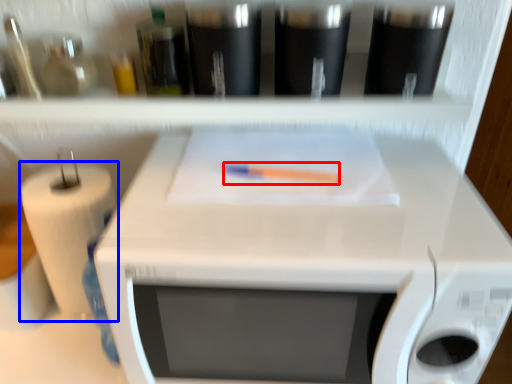
Question: Which of the following is the closest to the observer, crayon (highlighted by a red box) or paper towel (highlighted by a blue box)?

Choices:
 (A) crayon
 (B) paper towel

Answer: (A)